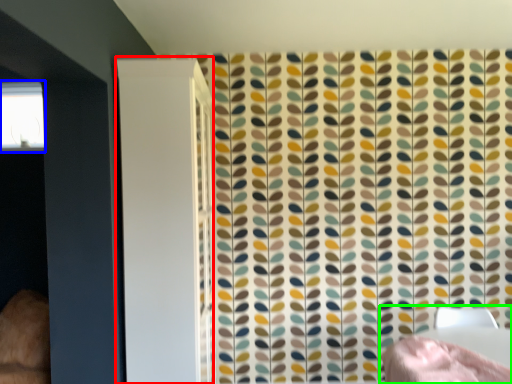
Question: Which is nearer to the screen door (highlighted by a red box)? window (highlighted by a blue box) or bed (highlighted by a green box).

Choices:
 (A) window
 (B) bed

Answer: (B)